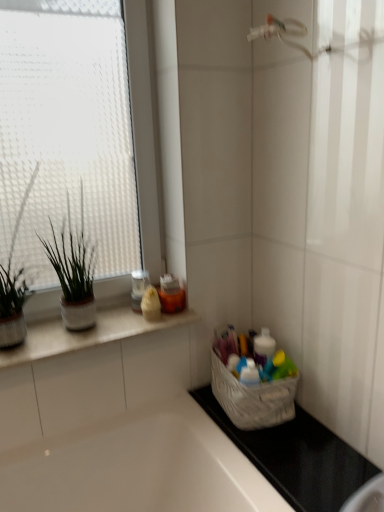
This screenshot has height=512, width=384. In order to click on free space above white ceramic countertop at upper left (from a real-world perspective) in this screenshot , I will do `click(88, 326)`.